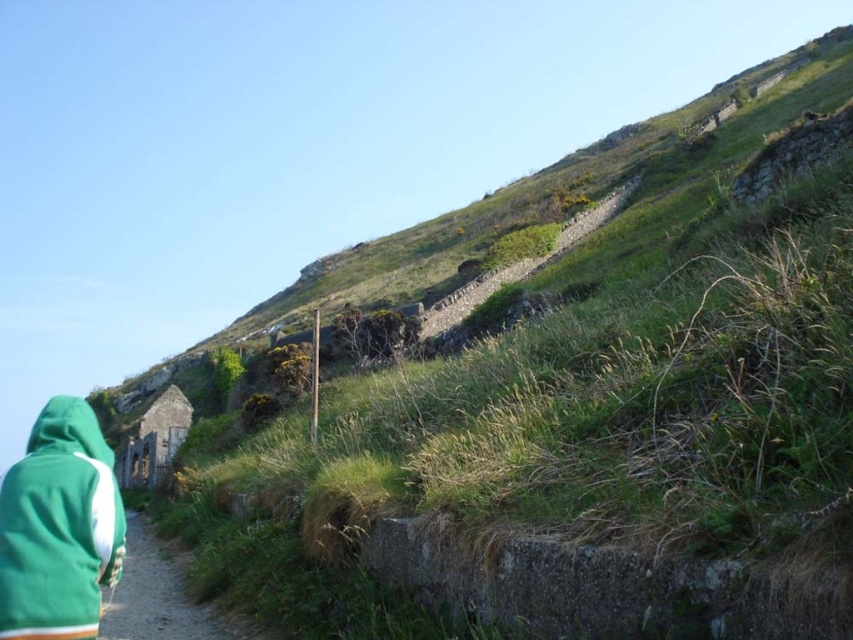
Who is positioned more to the left, green fleece sweatshirt at lower left or green fabric at lower left?

green fabric at lower left is more to the left.

How much distance is there between green fleece sweatshirt at lower left and green fabric at lower left?

35.39 feet

This screenshot has width=853, height=640. In order to click on green fleece sweatshirt at lower left in this screenshot , I will do `click(59, 528)`.

Find the location of `green fleece sweatshirt at lower left`. green fleece sweatshirt at lower left is located at coordinates (59, 528).